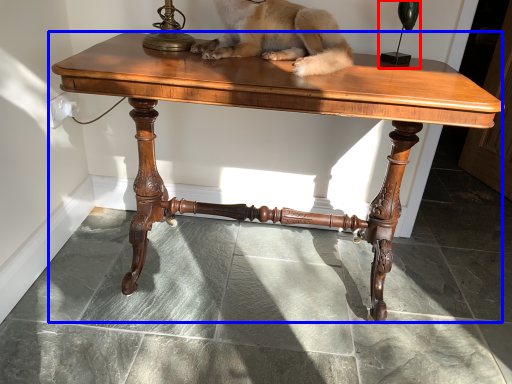
Question: Which object is further to the camera taking this photo, candle holder (highlighted by a red box) or table (highlighted by a blue box)?

Choices:
 (A) candle holder
 (B) table

Answer: (A)